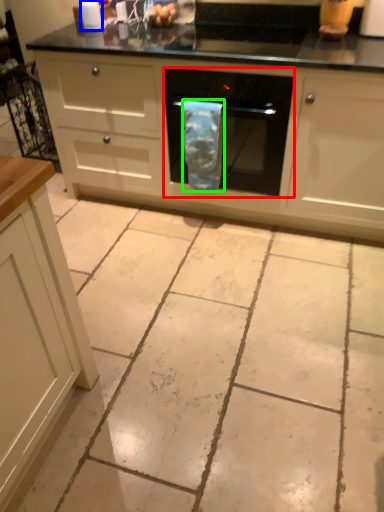
Question: Which is nearer to the home appliance (highlighted by a red box)? kitchen appliance (highlighted by a blue box) or material (highlighted by a green box).

Choices:
 (A) kitchen appliance
 (B) material

Answer: (B)